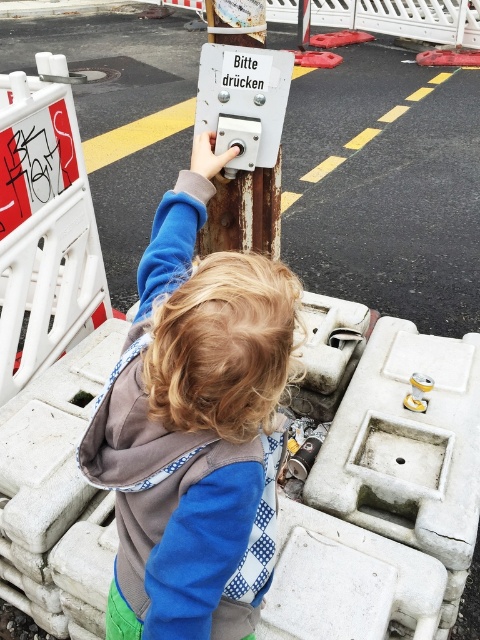
You are a pedestrian trying to cross the street at the intersection shown. You see the blue fleece jacket at center and the rusty metal button at center. Which object is closer to the ground?

The blue fleece jacket at center is closer to the ground because it is below the rusty metal button at center.

You are a pedestrian trying to cross the street at the intersection shown. You see the blue fleece jacket at center and the rusty metal button at center. Which object is closer to you?

The blue fleece jacket at center is closer to the viewer than the rusty metal button at center.

You are a pedestrian trying to cross the street at the intersection shown. You see the blue fleece jacket at center and the rusty metal button at center. Which object is taller?

The blue fleece jacket at center is taller than the rusty metal button at center.